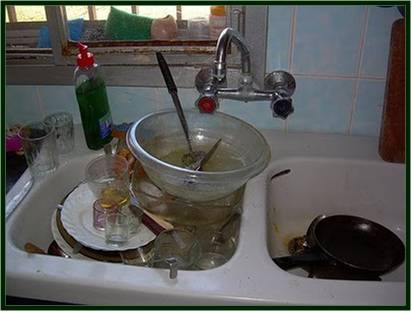
Find the location of `plate`. plate is located at coordinates (79, 221).